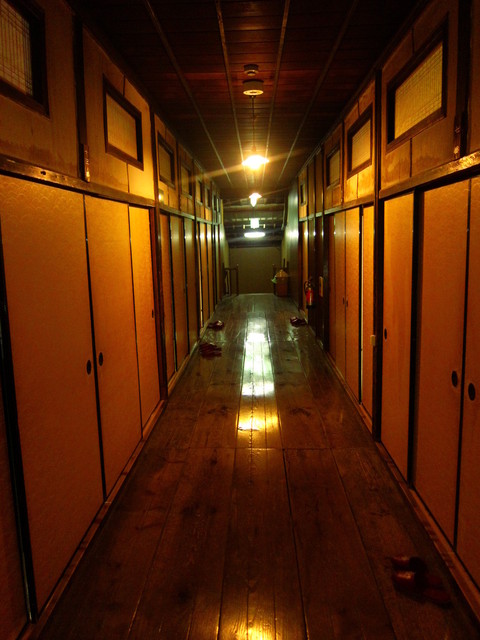
Where is `floor`? This screenshot has width=480, height=640. floor is located at coordinates (256, 479).